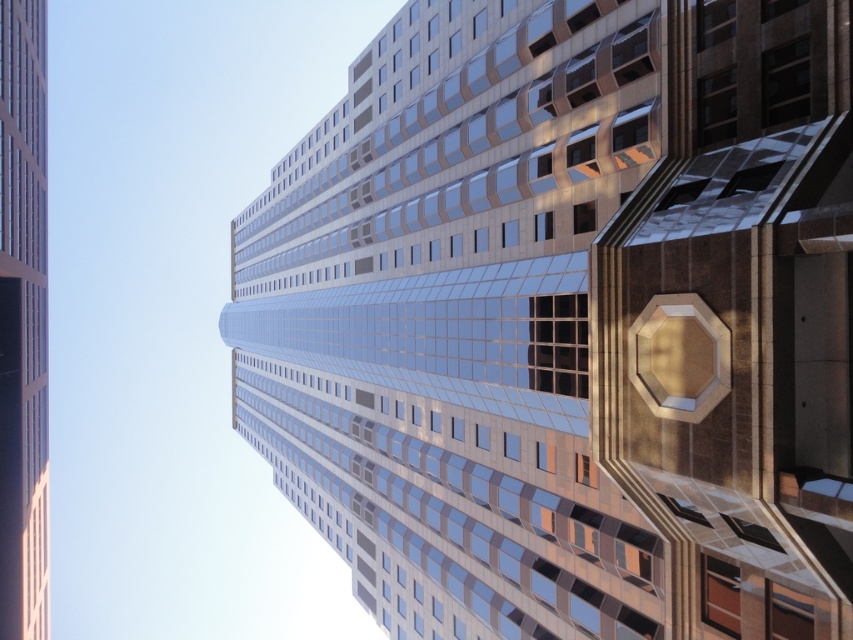
Is glossy glass tower at center above glassy reflective skyscraper at center?

Actually, glossy glass tower at center is below glassy reflective skyscraper at center.

Image resolution: width=853 pixels, height=640 pixels. Identify the location of glossy glass tower at center. (567, 321).